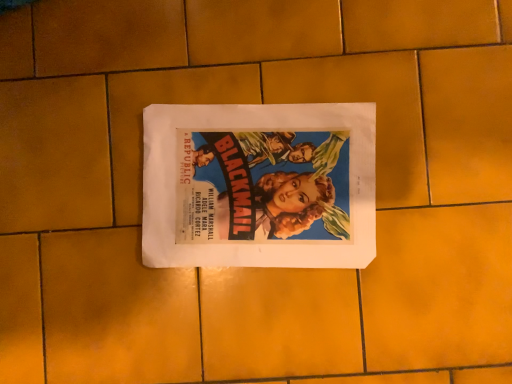
Question: Should I look upward or downward to see matte paper poster at center?

Choices:
 (A) up
 (B) down

Answer: (A)